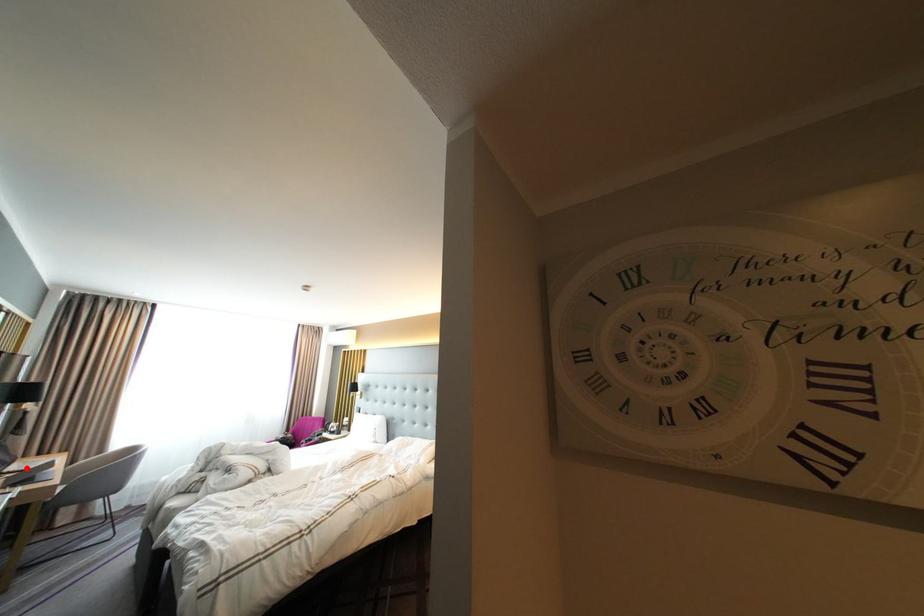
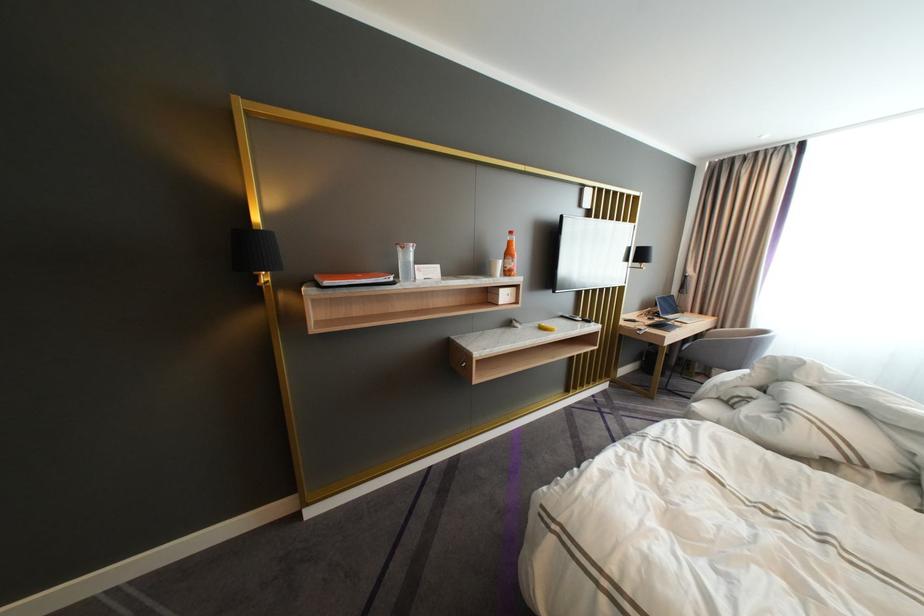
Question: I am providing you with two images of the same scene from different viewpoints. A red point is shown in image1. For the corresponding object point in image2, is it positioned nearer or farther from the camera?

Choices:
 (A) Nearer
 (B) Farther

Answer: (A)